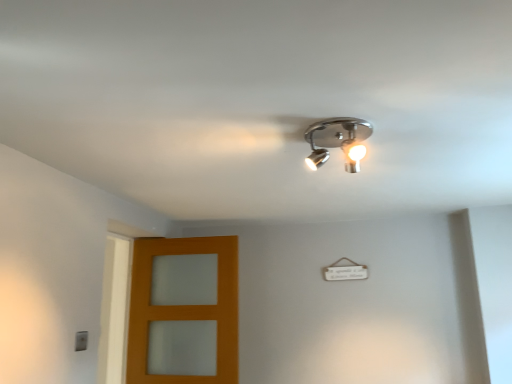
Question: Is chrome/metallic spotlight at upper center at the right side of orange wood door at lower left?

Choices:
 (A) no
 (B) yes

Answer: (B)

Question: Does chrome/metallic spotlight at upper center have a lesser height compared to orange wood door at lower left?

Choices:
 (A) no
 (B) yes

Answer: (B)

Question: Is chrome/metallic spotlight at upper center at the left side of orange wood door at lower left?

Choices:
 (A) no
 (B) yes

Answer: (A)

Question: Does chrome/metallic spotlight at upper center have a larger size compared to orange wood door at lower left?

Choices:
 (A) yes
 (B) no

Answer: (B)

Question: Is chrome/metallic spotlight at upper center located outside orange wood door at lower left?

Choices:
 (A) yes
 (B) no

Answer: (A)

Question: Considering the relative sizes of chrome/metallic spotlight at upper center and orange wood door at lower left in the image provided, is chrome/metallic spotlight at upper center wider than orange wood door at lower left?

Choices:
 (A) yes
 (B) no

Answer: (A)

Question: From the image's perspective, would you say orange wood door at lower left is positioned over chrome/metallic spotlight at upper center?

Choices:
 (A) yes
 (B) no

Answer: (B)

Question: Considering the relative sizes of orange wood door at lower left and chrome/metallic spotlight at upper center in the image provided, is orange wood door at lower left thinner than chrome/metallic spotlight at upper center?

Choices:
 (A) no
 (B) yes

Answer: (B)

Question: From a real-world perspective, is orange wood door at lower left on top of chrome/metallic spotlight at upper center?

Choices:
 (A) yes
 (B) no

Answer: (B)

Question: Is orange wood door at lower left smaller than chrome/metallic spotlight at upper center?

Choices:
 (A) no
 (B) yes

Answer: (A)

Question: Would you say chrome/metallic spotlight at upper center is part of orange wood door at lower left's contents?

Choices:
 (A) no
 (B) yes

Answer: (A)

Question: Considering the relative sizes of orange wood door at lower left and chrome/metallic spotlight at upper center in the image provided, is orange wood door at lower left bigger than chrome/metallic spotlight at upper center?

Choices:
 (A) yes
 (B) no

Answer: (A)

Question: From their relative heights in the image, would you say chrome/metallic spotlight at upper center is taller or shorter than orange wood door at lower left?

Choices:
 (A) tall
 (B) short

Answer: (B)